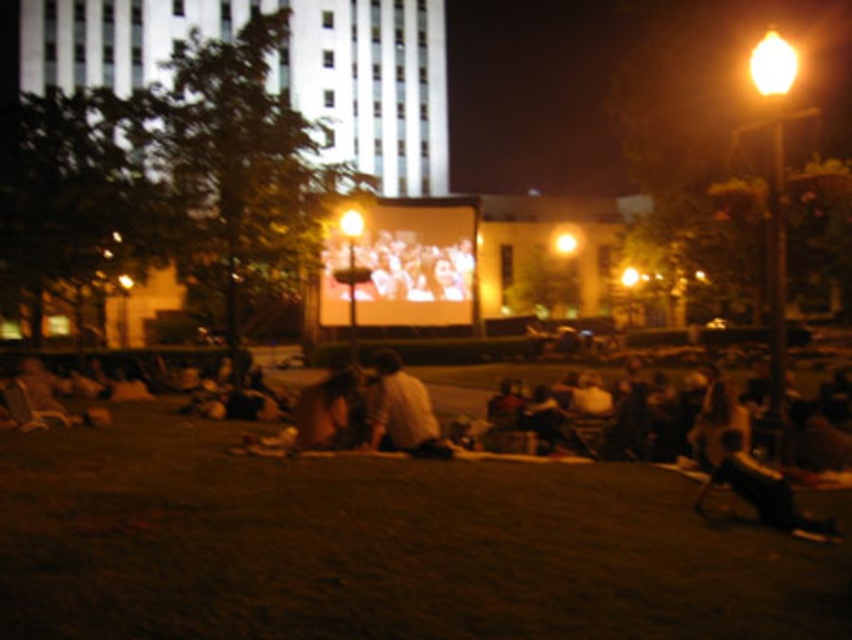
This screenshot has height=640, width=852. What do you see at coordinates (417, 262) in the screenshot?
I see `matte screen at center` at bounding box center [417, 262].

Between matte screen at center and light brown fabric shirt at center, which one is positioned lower?

Positioned lower is light brown fabric shirt at center.

Who is more forward, (394, 252) or (398, 365)?

Point (398, 365)

The width and height of the screenshot is (852, 640). Find the location of `matte screen at center`. matte screen at center is located at coordinates (417, 262).